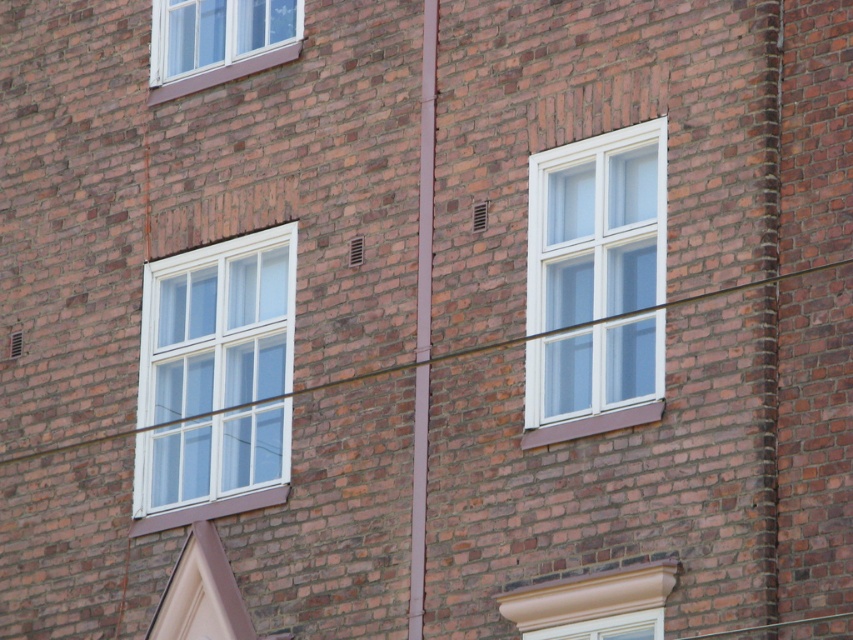
Which is behind, point (225, 417) or point (618, 273)?

Positioned behind is point (225, 417).

Measure the distance between white plastic window at center-left and white plastic window at center.

They are 21.39 feet apart.

Is point (228, 292) positioned before point (537, 422)?

No, (228, 292) is behind (537, 422).

Locate an element on the screen. The image size is (853, 640). white plastic window at center-left is located at coordinates (213, 378).

Is white plastic window at center further to the viewer compared to white plastic window at upper left?

No.

Is point (599, 228) positioned behind point (293, 26)?

That is False.

Where is `white plastic window at center`? white plastic window at center is located at coordinates (595, 284).

Measure the distance between white plastic window at center-left and white plastic window at upper left.

9.81 meters

Who is more distant from viewer, [231,328] or [195,74]?

Positioned behind is point [195,74].

Does point (149, 321) lie in front of point (167, 12)?

Yes, it is in front of point (167, 12).

Find the location of a particular element. The width and height of the screenshot is (853, 640). white plastic window at center-left is located at coordinates (213, 378).